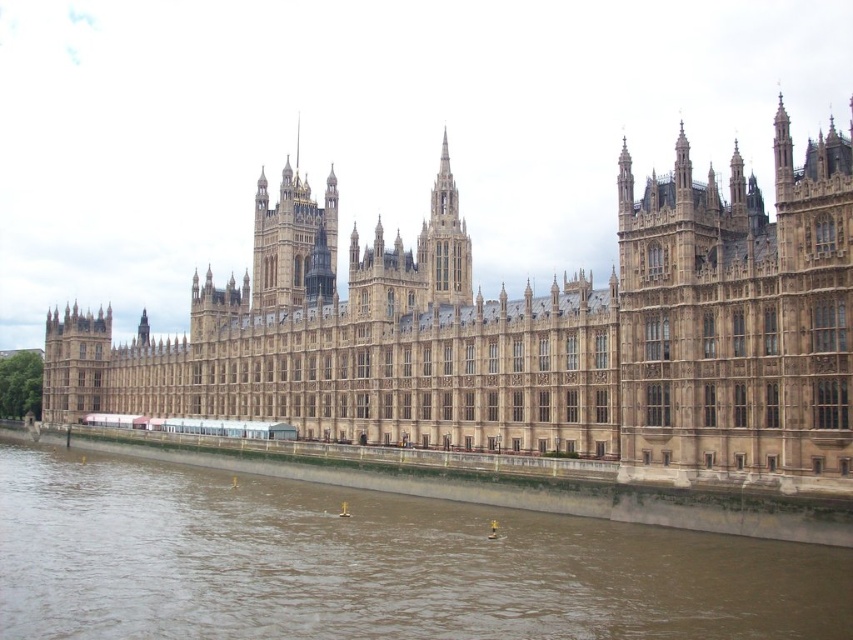
You are standing on the bank of the Thames and see the brown stone castle at center and the smooth stone spire at center. Which structure would appear larger to you?

The brown stone castle at center is closer to the viewer than the smooth stone spire at center, so it would appear larger.

You are standing on the Thames riverbank and want to take a photo of the smooth stone spire at center. The brown sedimentary river at lower left is in your way. Can you move to your right to get a clear view?

Yes, since the brown sedimentary river at lower left is to the left of the smooth stone spire at center, moving to your right would allow you to position yourself away from the river and get a clear view of the spire.